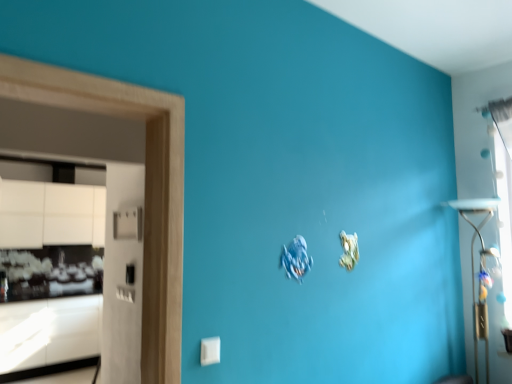
What do you see at coordinates (504, 191) in the screenshot? This screenshot has height=384, width=512. I see `transparent glass window at upper right` at bounding box center [504, 191].

Locate an element on the screen. transparent glass window at upper right is located at coordinates (504, 191).

Describe the element at coordinates (49, 332) in the screenshot. I see `white glossy cabinetry at left` at that location.

Measure the distance between point (33, 356) and camera.

They are 5.57 meters apart.

Where is `white glossy cabinetry at left`? The image size is (512, 384). white glossy cabinetry at left is located at coordinates (49, 332).

Where is `transparent glass window at upper right`? transparent glass window at upper right is located at coordinates (504, 191).

Can you confirm if white glossy cabinetry at left is positioned to the right of transparent glass window at upper right?

No, white glossy cabinetry at left is not to the right of transparent glass window at upper right.

Which object is further away from the camera taking this photo, white glossy cabinetry at left or transparent glass window at upper right?

white glossy cabinetry at left is behind.

Between point (0, 366) and point (503, 185), which one is positioned in front?

The point (503, 185) is closer.

From the image's perspective, is white glossy cabinetry at left located above transparent glass window at upper right?

Actually, white glossy cabinetry at left appears below transparent glass window at upper right in the image.

Based on the photo, from a real-world perspective, which object stands above the other?

transparent glass window at upper right is physically above.

Looking at their sizes, would you say white glossy cabinetry at left is wider or thinner than transparent glass window at upper right?

Considering their sizes, white glossy cabinetry at left looks broader than transparent glass window at upper right.

Which of these two, white glossy cabinetry at left or transparent glass window at upper right, stands taller?

Standing taller between the two is transparent glass window at upper right.

Based on their sizes in the image, would you say white glossy cabinetry at left is bigger or smaller than transparent glass window at upper right?

Considering their sizes, white glossy cabinetry at left takes up more space than transparent glass window at upper right.

Is white glossy cabinetry at left not within transparent glass window at upper right?

Yes, white glossy cabinetry at left is outside of transparent glass window at upper right.

Is white glossy cabinetry at left not close to transparent glass window at upper right?

That's right, there is a large distance between white glossy cabinetry at left and transparent glass window at upper right.

Is white glossy cabinetry at left facing away from transparent glass window at upper right?

No, transparent glass window at upper right is not at the back of white glossy cabinetry at left.

Can you tell me how much white glossy cabinetry at left and transparent glass window at upper right differ in facing direction?

There is a 90-degree angle between the facing directions of white glossy cabinetry at left and transparent glass window at upper right.

How far apart are white glossy cabinetry at left and transparent glass window at upper right?

white glossy cabinetry at left and transparent glass window at upper right are 5.67 meters apart.

The width and height of the screenshot is (512, 384). I want to click on window above the white glossy cabinetry at left (from a real-world perspective), so click(x=504, y=191).

Between transparent glass window at upper right and white glossy cabinetry at left, which one appears on the right side from the viewer's perspective?

transparent glass window at upper right.

Relative to white glossy cabinetry at left, is transparent glass window at upper right in front or behind?

Result: In the image, transparent glass window at upper right appears in front of white glossy cabinetry at left.

Considering the positions of points (500, 130) and (96, 297), is point (500, 130) closer to camera compared to point (96, 297)?

Yes, point (500, 130) is in front of point (96, 297).

From the image's perspective, is transparent glass window at upper right below white glossy cabinetry at left?

No.

From a real-world perspective, between transparent glass window at upper right and white glossy cabinetry at left, who is vertically lower?

From a 3D spatial view, white glossy cabinetry at left is below.

Between transparent glass window at upper right and white glossy cabinetry at left, which one has smaller width?

transparent glass window at upper right.

Is transparent glass window at upper right taller than white glossy cabinetry at left?

Correct, transparent glass window at upper right is much taller as white glossy cabinetry at left.

Considering the sizes of objects transparent glass window at upper right and white glossy cabinetry at left in the image provided, who is bigger, transparent glass window at upper right or white glossy cabinetry at left?

Bigger between the two is white glossy cabinetry at left.

Is transparent glass window at upper right outside of white glossy cabinetry at left?

Yes, transparent glass window at upper right is not within white glossy cabinetry at left.

Is there a large distance between transparent glass window at upper right and white glossy cabinetry at left?

transparent glass window at upper right is positioned a significant distance from white glossy cabinetry at left.

Could you tell me if transparent glass window at upper right is facing white glossy cabinetry at left?

No, transparent glass window at upper right is not oriented towards white glossy cabinetry at left.

How many degrees apart are the facing directions of transparent glass window at upper right and white glossy cabinetry at left?

There is a 90-degree angle between the facing directions of transparent glass window at upper right and white glossy cabinetry at left.

Image resolution: width=512 pixels, height=384 pixels. Identify the location of cabinetry beneath the transparent glass window at upper right (from a real-world perspective). (49, 332).

I want to click on cabinetry below the transparent glass window at upper right (from a real-world perspective), so click(49, 332).

The height and width of the screenshot is (384, 512). Identify the location of cabinetry lying behind the transparent glass window at upper right. (49, 332).